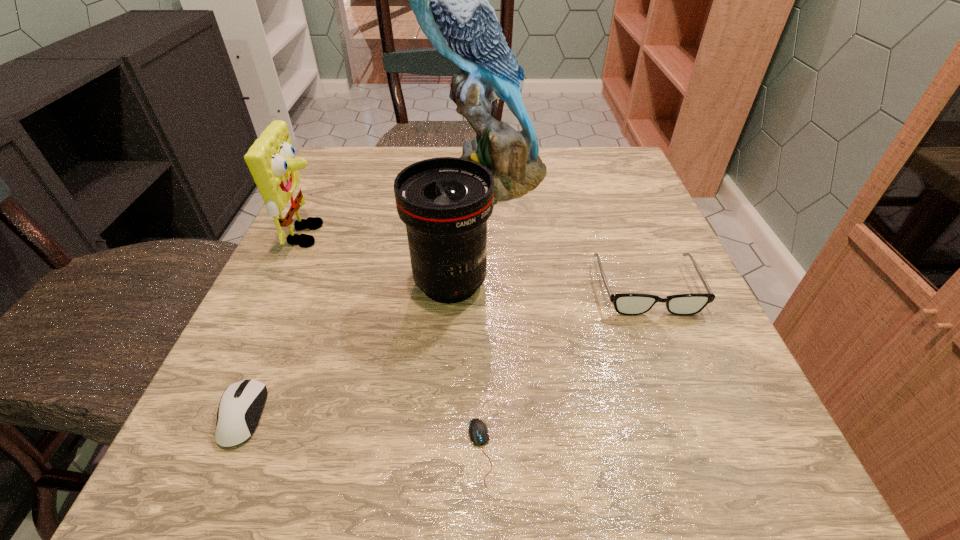
Identify the location of free space located 0.100m on the face of the parakeet. The width and height of the screenshot is (960, 540). (381, 180).

Find the location of `vacant region located on the face of the parakeet`. vacant region located on the face of the parakeet is located at coordinates (390, 180).

Identify the location of vacant space situated 0.200m on the face of the parakeet. This screenshot has height=540, width=960. (337, 180).

At what (x,y) coordinates should I click in order to perform the action: click on vacant space located 0.130m on the face of the sponge. Please return your answer as a coordinate pair (x, y). The width and height of the screenshot is (960, 540). Looking at the image, I should click on (396, 235).

You are a GUI agent. You are given a task and a screenshot of the screen. Output one action in this format:
    pyautogui.click(x=<x>, y=<y>)
    Task: Click on the free region located 0.280m on the back of the telephoto lens
    
    Given the screenshot: What is the action you would take?
    pyautogui.click(x=458, y=177)

Find the location of a particular element. vacant space located 0.270m on the front-facing side of the rightmost object is located at coordinates (729, 497).

At what (x,y) coordinates should I click in order to perform the action: click on vacant space located 0.060m on the back of the second shortest object. Please return your answer as a coordinate pair (x, y). Looking at the image, I should click on (271, 349).

The height and width of the screenshot is (540, 960). What are the coordinates of `free point located on the left of the shorter mouse` in the screenshot? It's located at (245, 452).

This screenshot has height=540, width=960. What are the coordinates of `object at the far edge` in the screenshot? It's located at (449, 0).

You are a GUI agent. You are given a task and a screenshot of the screen. Output one action in this format:
    pyautogui.click(x=<x>, y=<y>)
    Task: Click on the sponge at the left edge
    This screenshot has height=540, width=960.
    Given the screenshot: What is the action you would take?
    pyautogui.click(x=271, y=160)